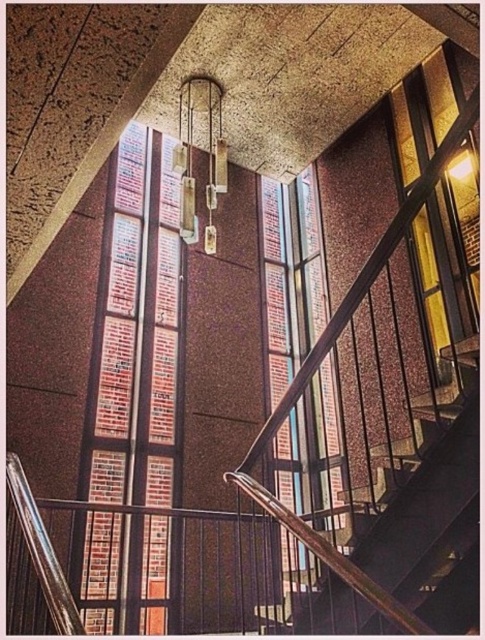
Question: Which point is farther to the camera?

Choices:
 (A) (132, 584)
 (B) (307, 400)

Answer: (B)

Question: Can you confirm if brick-patterned glass window at left is positioned above clear glass window at center?

Choices:
 (A) yes
 (B) no

Answer: (B)

Question: Which object is closer to the camera taking this photo?

Choices:
 (A) brick-patterned glass window at left
 (B) clear glass window at center

Answer: (A)

Question: Which of the following is the farthest from the observer?

Choices:
 (A) brick-patterned glass window at left
 (B) clear glass window at center

Answer: (B)

Question: Can you confirm if brick-patterned glass window at left is smaller than clear glass window at center?

Choices:
 (A) no
 (B) yes

Answer: (A)

Question: Is brick-patterned glass window at left bigger than clear glass window at center?

Choices:
 (A) no
 (B) yes

Answer: (B)